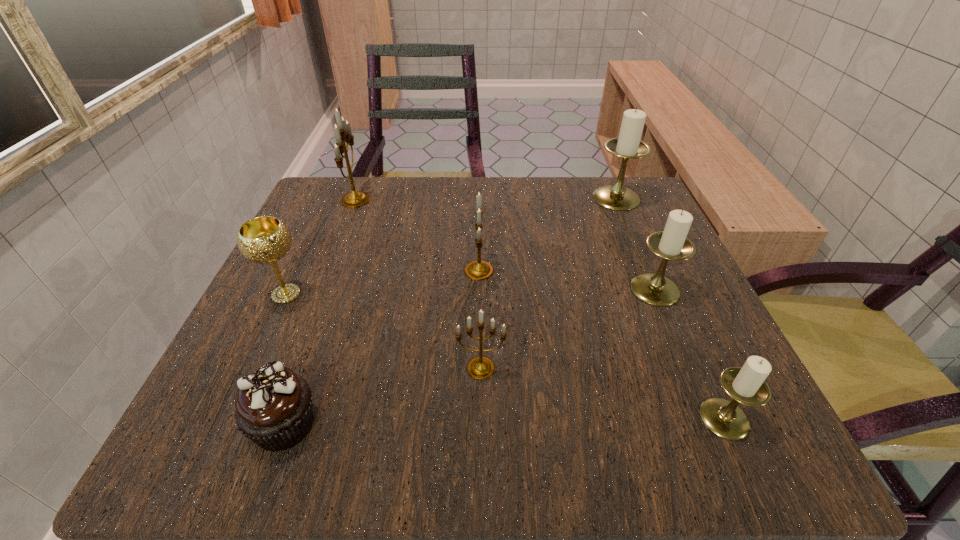
Find the location of a particular element. The width and height of the screenshot is (960, 540). the farthest white candle holder is located at coordinates (628, 145).

Find the location of a particular element. This screenshot has height=540, width=960. the leftmost gold candelabrum is located at coordinates (342, 130).

Identify the location of the biggest gold candelabrum. (342, 130).

Locate an element on the screen. Image resolution: width=960 pixels, height=540 pixels. the second farthest gold candelabrum is located at coordinates (477, 270).

Where is `the second biggest white candle holder`? The width and height of the screenshot is (960, 540). the second biggest white candle holder is located at coordinates (671, 244).

Locate an element on the screen. The height and width of the screenshot is (540, 960). chalice is located at coordinates pos(266,239).

The width and height of the screenshot is (960, 540). Identify the location of the sixth farthest object. (480, 367).

Where is `the fifth farthest candle holder`? This screenshot has width=960, height=540. the fifth farthest candle holder is located at coordinates (480, 367).

This screenshot has height=540, width=960. What are the coordinates of `the nearest candle holder` in the screenshot? It's located at (747, 385).

At what (x,y) coordinates should I click in order to perform the action: click on the smallest white candle holder. Please return your answer as a coordinate pair (x, y). Looking at the image, I should click on (747, 385).